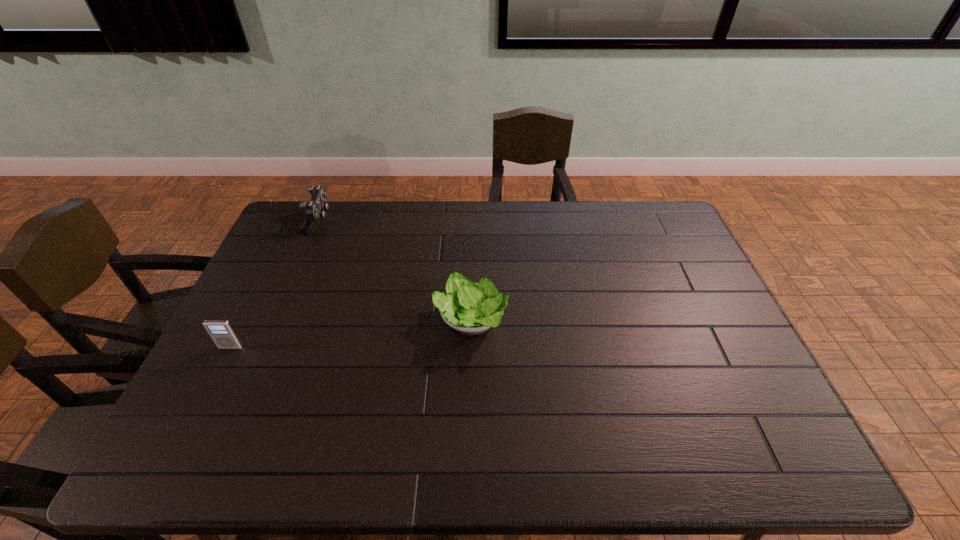
Locate an element on the screen. empty space between the leftmost object and the lettuce is located at coordinates (350, 334).

Where is `free point between the lettuce and the iPod`? The height and width of the screenshot is (540, 960). free point between the lettuce and the iPod is located at coordinates (350, 334).

Identify the location of free spot between the control and the iPod. Image resolution: width=960 pixels, height=540 pixels. (275, 284).

What are the coordinates of `vacant area that lies between the leftmost object and the control` in the screenshot? It's located at (275, 284).

What are the coordinates of `empty space between the rightmost object and the control` in the screenshot? It's located at (395, 271).

Where is `free space that is in between the leftmost object and the lettuce`? free space that is in between the leftmost object and the lettuce is located at coordinates (350, 334).

Find the location of a particular element. The image size is (960, 540). free space between the iPod and the control is located at coordinates (275, 284).

The width and height of the screenshot is (960, 540). Find the location of `the closest object to the farthest object`. the closest object to the farthest object is located at coordinates (221, 331).

Identify which object is the second closest to the rightmost object. Please provide its 2D coordinates. Your answer should be formatted as a tuple, i.e. [(x, y)], where the tuple contains the x and y coordinates of a point satisfying the conditions above.

[(221, 331)]

This screenshot has width=960, height=540. I want to click on free space that satisfies the following two spatial constraints: 1. on the surface of the rightmost object with buttons; 2. on the right side of the farthest object, so click(275, 321).